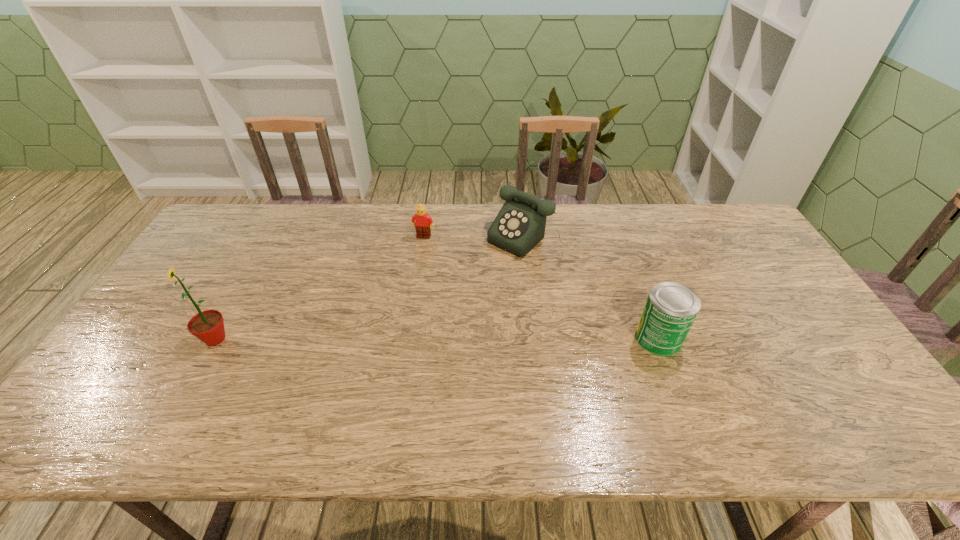
You are a GUI agent. You are given a task and a screenshot of the screen. Output one action in this format:
    pyautogui.click(x=<x>, y=<y>)
    Task: Click on the leftmost object
    The height and width of the screenshot is (540, 960).
    Given the screenshot: What is the action you would take?
    pyautogui.click(x=208, y=326)

This screenshot has width=960, height=540. I want to click on the tallest object, so click(x=208, y=326).

Image resolution: width=960 pixels, height=540 pixels. Identify the location of the rightmost object. (671, 308).

In order to click on the third object from left to right in this screenshot , I will do `click(520, 225)`.

What are the coordinates of `Lego` in the screenshot? It's located at (422, 221).

Find the location of a particular element. This screenshot has width=960, height=540. the second object from left to right is located at coordinates (422, 221).

At what (x,y) coordinates should I click in order to perform the action: click on vacant space located on the face of the tallest object. Please return your answer as a coordinate pair (x, y). Looking at the image, I should click on (174, 339).

Find the location of a particular element. The height and width of the screenshot is (540, 960). free space located 0.140m on the face of the tallest object is located at coordinates (148, 339).

You are a GUI agent. You are given a task and a screenshot of the screen. Output one action in this format:
    pyautogui.click(x=<x>, y=<y>)
    Task: Click on the vacant area located 0.130m on the face of the tallest object
    The image size is (960, 540).
    Given the screenshot: What is the action you would take?
    pyautogui.click(x=152, y=339)

Locate an element on the screen. vacant space located on the front of the can is located at coordinates (683, 401).